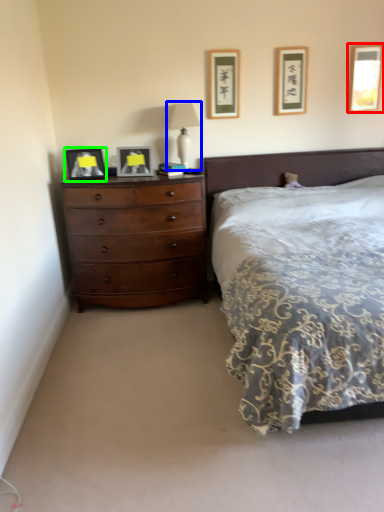
Question: Which object is the farthest from picture frame (highlighted by a red box)? Choose among these: bedside lamp (highlighted by a blue box) or picture frame (highlighted by a green box).

Choices:
 (A) bedside lamp
 (B) picture frame

Answer: (B)